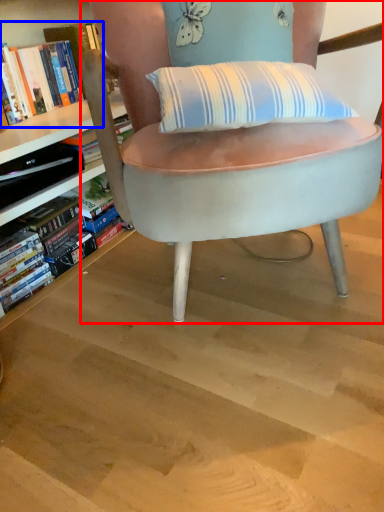
Question: Which of the following is the farthest to the observer, chair (highlighted by a red box) or book (highlighted by a blue box)?

Choices:
 (A) chair
 (B) book

Answer: (B)